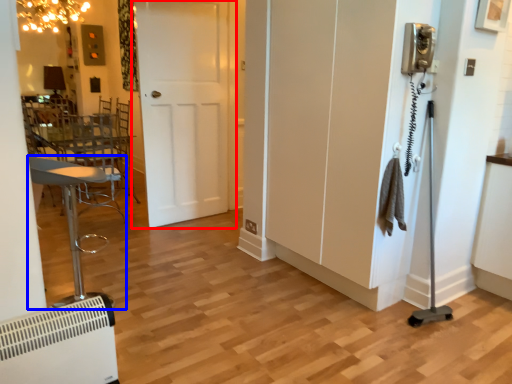
Question: Which point is further to the camera, door (highlighted by a red box) or furniture (highlighted by a blue box)?

Choices:
 (A) door
 (B) furniture

Answer: (A)